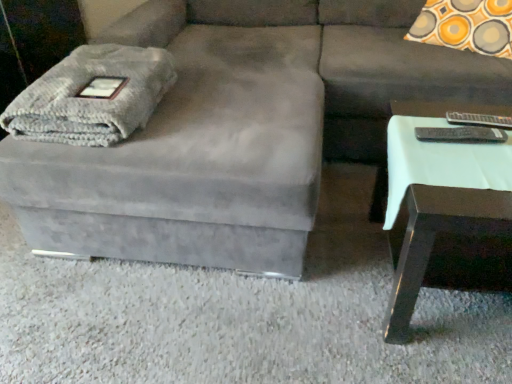
Question: Is orange-yellow circle-patterned pillow at upper right to the left or to the right of white glossy side table at right in the image?

Choices:
 (A) left
 (B) right

Answer: (B)

Question: From the image's perspective, relative to white glossy side table at right, is orange-yellow circle-patterned pillow at upper right above or below?

Choices:
 (A) above
 (B) below

Answer: (A)

Question: Considering the real-world distances, which object is closest to the gray knitted blanket at left?

Choices:
 (A) white glossy side table at right
 (B) orange-yellow circle-patterned pillow at upper right
 (C) suede gray couch at center

Answer: (C)

Question: Estimate the real-world distances between objects in this image. Which object is farther from the white glossy side table at right?

Choices:
 (A) suede gray couch at center
 (B) gray knitted blanket at left
 (C) orange-yellow circle-patterned pillow at upper right

Answer: (C)